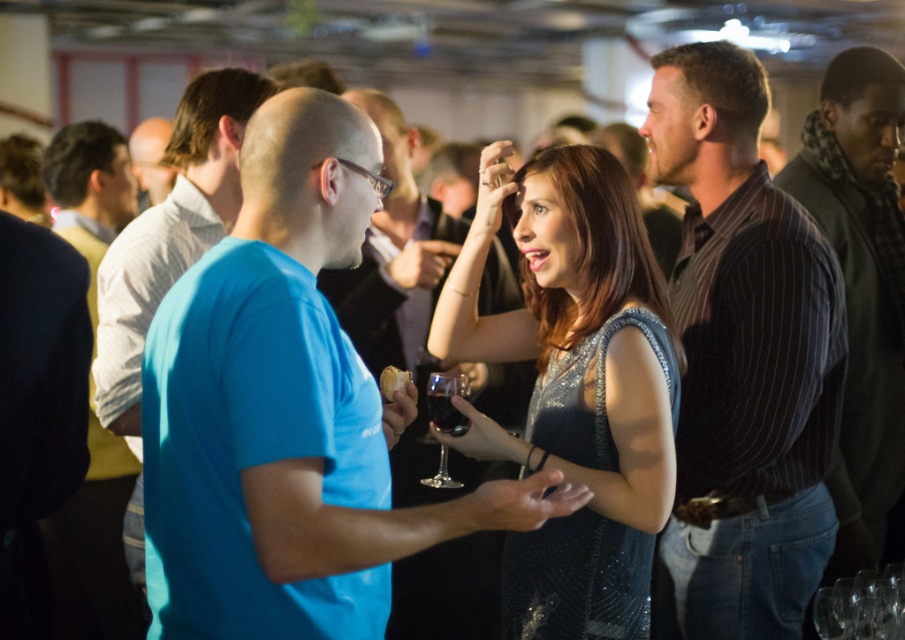
You are a photographer trying to capture a candid shot of the two points in the scene. Which point, point (164, 467) or point (138, 156), will appear larger in your camera viewfinder?

Point (164, 467) is closer to the viewer than point (138, 156), so it will appear larger in the camera viewfinder.